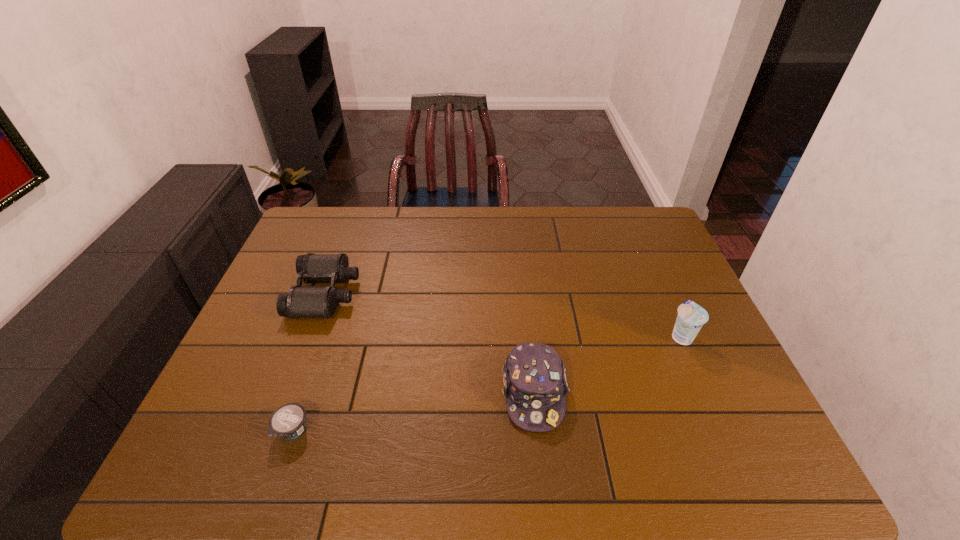
Find the location of a particular element. The height and width of the screenshot is (540, 960). blank region between the taller yogurt and the headwear is located at coordinates (608, 364).

Identify the location of object that ranks as the second closest to the binoculars. (534, 380).

Where is `object identified as the third closest to the binoculars`? Image resolution: width=960 pixels, height=540 pixels. object identified as the third closest to the binoculars is located at coordinates (691, 317).

What are the coordinates of `vacant space that satisfies the following two spatial constraints: 1. through the eyepieces of the rightmost object; 2. on the left side of the binoculars` in the screenshot? It's located at (309, 336).

I want to click on vacant space that satisfies the following two spatial constraints: 1. through the eyepieces of the binoculars; 2. on the right side of the shorter yogurt, so click(275, 430).

Locate an element on the screen. The width and height of the screenshot is (960, 540). free space that satisfies the following two spatial constraints: 1. through the eyepieces of the binoculars; 2. on the right side of the rightmost object is located at coordinates (309, 336).

The height and width of the screenshot is (540, 960). What are the coordinates of `vacant position in the image that satisfies the following two spatial constraints: 1. on the back side of the shortest object; 2. on the left side of the farther yogurt` in the screenshot? It's located at (324, 336).

At what (x,y) coordinates should I click in order to perform the action: click on vacant area in the image that satisfies the following two spatial constraints: 1. on the back side of the shortest object; 2. through the eyepieces of the binoculars. Please return your answer as a coordinate pair (x, y). Image resolution: width=960 pixels, height=540 pixels. Looking at the image, I should click on point(339,293).